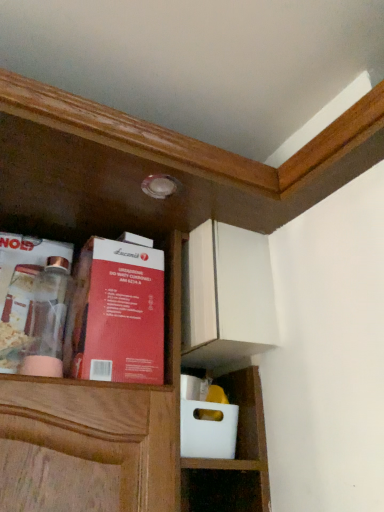
Question: Is clear glass jar at left, which ranks as the 2th book in right-to-left order, wider than red cardboard box at upper left, arranged as the 2th book when viewed from the left?

Choices:
 (A) yes
 (B) no

Answer: (B)

Question: Would you say clear glass jar at left, which ranks as the 2th book in right-to-left order, contains red cardboard box at upper left, the first book viewed from the right?

Choices:
 (A) yes
 (B) no

Answer: (B)

Question: From a real-world perspective, does clear glass jar at left, which ranks as the 2th book in right-to-left order, sit lower than red cardboard box at upper left, arranged as the 2th book when viewed from the left?

Choices:
 (A) yes
 (B) no

Answer: (B)

Question: Does clear glass jar at left, which ranks as the 2th book in right-to-left order, have a lesser height compared to red cardboard box at upper left, arranged as the 2th book when viewed from the left?

Choices:
 (A) no
 (B) yes

Answer: (B)

Question: Is clear glass jar at left, positioned as the 1th book in left-to-right order, smaller than red cardboard box at upper left, the first book viewed from the right?

Choices:
 (A) no
 (B) yes

Answer: (B)

Question: Is clear glass jar at left, positioned as the 1th book in left-to-right order, facing away from red cardboard box at upper left, arranged as the 2th book when viewed from the left?

Choices:
 (A) yes
 (B) no

Answer: (B)

Question: Is red cardboard box at upper left, the first book viewed from the right, facing towards clear glass jar at left, which ranks as the 2th book in right-to-left order?

Choices:
 (A) no
 (B) yes

Answer: (A)

Question: Does red cardboard box at upper left, arranged as the 2th book when viewed from the left, have a lesser height compared to clear glass jar at left, positioned as the 1th book in left-to-right order?

Choices:
 (A) yes
 (B) no

Answer: (B)

Question: Is red cardboard box at upper left, the first book viewed from the right, not close to clear glass jar at left, positioned as the 1th book in left-to-right order?

Choices:
 (A) no
 (B) yes

Answer: (A)

Question: Does red cardboard box at upper left, the first book viewed from the right, have a smaller size compared to clear glass jar at left, positioned as the 1th book in left-to-right order?

Choices:
 (A) yes
 (B) no

Answer: (B)

Question: Can you confirm if red cardboard box at upper left, the first book viewed from the right, is taller than clear glass jar at left, positioned as the 1th book in left-to-right order?

Choices:
 (A) no
 (B) yes

Answer: (B)

Question: Is red cardboard box at upper left, arranged as the 2th book when viewed from the left, to the right of clear glass jar at left, which ranks as the 2th book in right-to-left order, from the viewer's perspective?

Choices:
 (A) no
 (B) yes

Answer: (B)

Question: Is clear glass jar at left, which ranks as the 2th book in right-to-left order, in front of or behind red cardboard box at upper left, the first book viewed from the right, in the image?

Choices:
 (A) front
 (B) behind

Answer: (B)